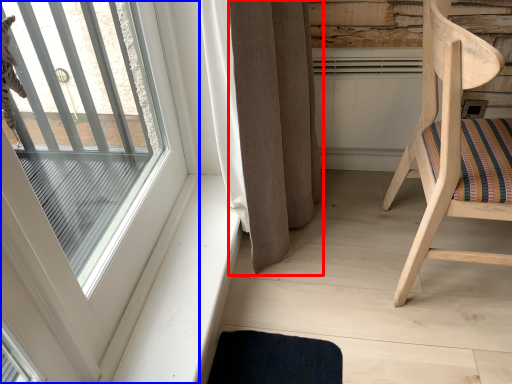
Question: Among these objects, which one is farthest to the camera, curtain (highlighted by a red box) or window (highlighted by a blue box)?

Choices:
 (A) curtain
 (B) window

Answer: (A)